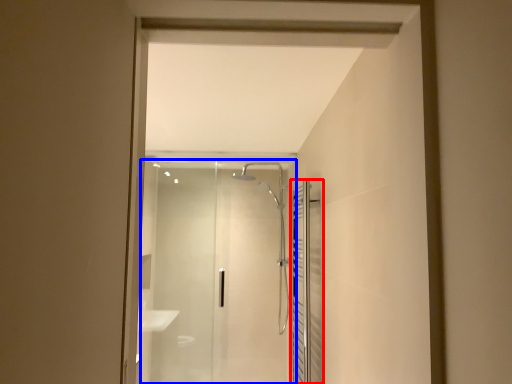
Question: Which object appears farthest to the camera in this image, screen door (highlighted by a red box) or screen door (highlighted by a blue box)?

Choices:
 (A) screen door
 (B) screen door

Answer: (B)